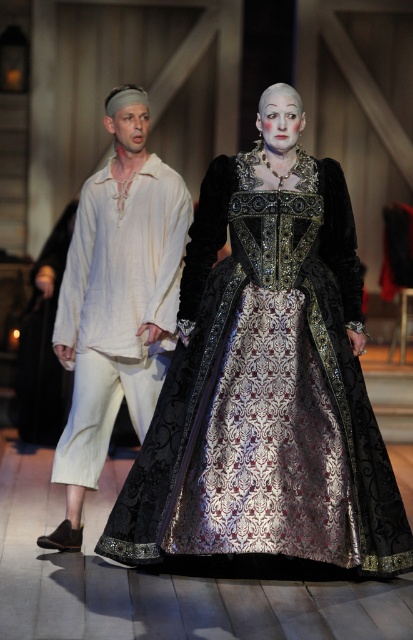
From the picture: You are an audience member sitting in the front row of the theater. You notice two characters on stage wearing the silvery brocade dress at center and the light beige linen shirt at left. Which character is positioned lower in the scene?

The silvery brocade dress at center is positioned lower than the light beige linen shirt at left in the scene.

You are an assistant helping to arrange costumes for a play. You need to place the silvery brocade dress at center and the light beige linen shirt at left on a rack. Considering their heights, which one should be placed on the lower hanger to ensure they both fit on the rack without overlapping?

The silvery brocade dress at center has a lesser height compared to the light beige linen shirt at left, so it should be placed on the lower hanger to avoid overlapping with the taller light beige linen shirt at left.

You are standing on the stage and see two points marked on the floor. The first point is at coordinates point [360,468] and the second is at point [66,458]. Which point is closer to you?

Point [360,468] is closer to the viewer than point [66,458].